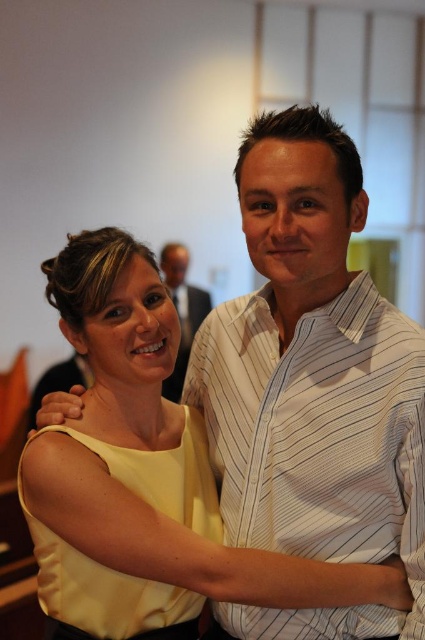
Can you confirm if yellow satin dress at center is shorter than matte black suit at center?

Indeed, yellow satin dress at center has a lesser height compared to matte black suit at center.

What do you see at coordinates (101, 589) in the screenshot? The width and height of the screenshot is (425, 640). I see `yellow satin dress at center` at bounding box center [101, 589].

Identify the location of yellow satin dress at center. (101, 589).

Looking at this image, who is taller, white striped shirt at center or yellow satin dress at center?

white striped shirt at center is taller.

Does white striped shirt at center lie behind yellow satin dress at center?

No.

Which is in front, point (263, 512) or point (48, 612)?

Point (263, 512)

Identify the location of white striped shirt at center. Image resolution: width=425 pixels, height=640 pixels. (317, 448).

From the picture: Can you confirm if white striped shirt at center is positioned above matte black suit at center?

No, white striped shirt at center is not above matte black suit at center.

Is white striped shirt at center to the right of matte black suit at center from the viewer's perspective?

Indeed, white striped shirt at center is positioned on the right side of matte black suit at center.

Does point (388, 410) come closer to viewer compared to point (161, 260)?

Yes, point (388, 410) is closer to viewer.

You are a GUI agent. You are given a task and a screenshot of the screen. Output one action in this format:
    pyautogui.click(x=<x>, y=<y>)
    Task: Click on the white striped shirt at center
    
    Given the screenshot: What is the action you would take?
    pyautogui.click(x=317, y=448)